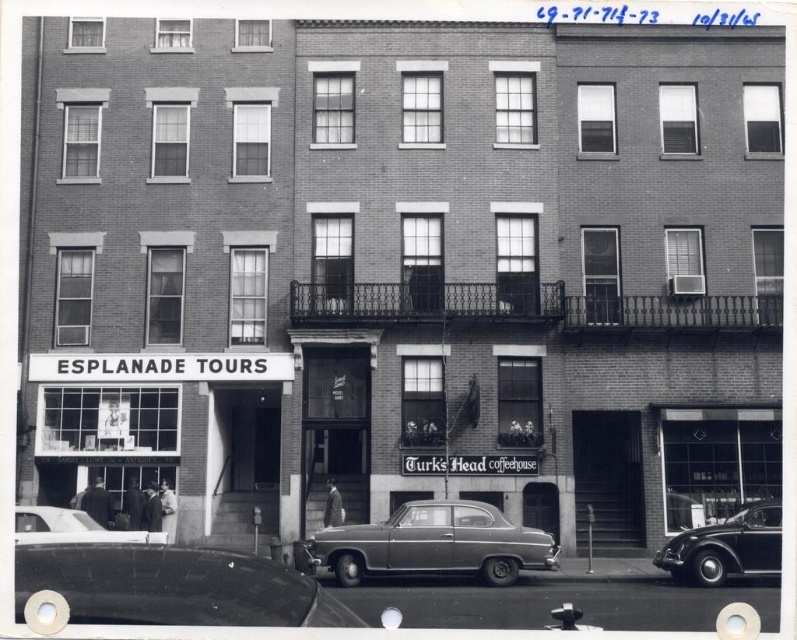
Is point (338, 577) positioned after point (75, 529)?

That is True.

This screenshot has height=640, width=797. Find the location of `metallic gray sedan at center`. metallic gray sedan at center is located at coordinates (434, 545).

Which is behind, point (523, 532) or point (65, 512)?

Point (523, 532)

Identify the location of metallic gray sedan at center. [x=434, y=545].

Does shiny black sedan at lower left come behind shiny black car at lower right?

That is False.

Can you confirm if shiny black sedan at lower left is shorter than shiny black car at lower right?

Indeed, shiny black sedan at lower left has a lesser height compared to shiny black car at lower right.

Does point (262, 570) lie behind point (735, 513)?

No, (262, 570) is closer to viewer.

I want to click on shiny black sedan at lower left, so click(173, 586).

Is point (313, 625) positioned before point (36, 358)?

Yes, point (313, 625) is in front of point (36, 358).

Who is positioned more to the right, shiny black sedan at lower left or white matte signboard at lower left?

Positioned to the right is shiny black sedan at lower left.

At what (x,y) coordinates should I click in order to perform the action: click on shiny black sedan at lower left. Please return your answer as a coordinate pair (x, y). The width and height of the screenshot is (797, 640). Looking at the image, I should click on (173, 586).